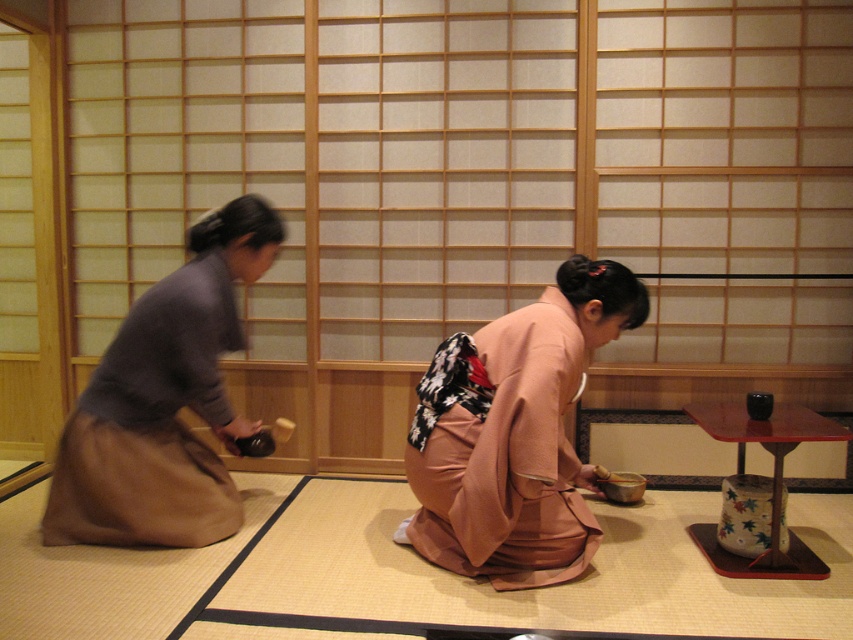
You are a photographer standing at the entrance of the tea ceremony room. You want to take a photo of the pink silk kimono at center without moving any objects. Can you fit the entire kimono into your camera frame if your camera has a maximum field of view of 6 feet?

The two people are 7.62 feet apart. Since the camera can only capture 6 feet in its field of view, the entire pink silk kimono at center cannot be captured without moving someone.

You are a photographer planning to take a closeup shot of the pink silk kimono at center and the matte brown skirt at left. Since you want to capture both items clearly, which one should you focus on first considering their positions relative to the camera?

The pink silk kimono at center is shorter than the matte brown skirt at left, so you should focus on the matte brown skirt at left first because it is closer to the camera.

What is the location of the point with coordinates (514, 433) in the image?

The point with coordinates (514, 433) is located on the pink silk kimono at center.